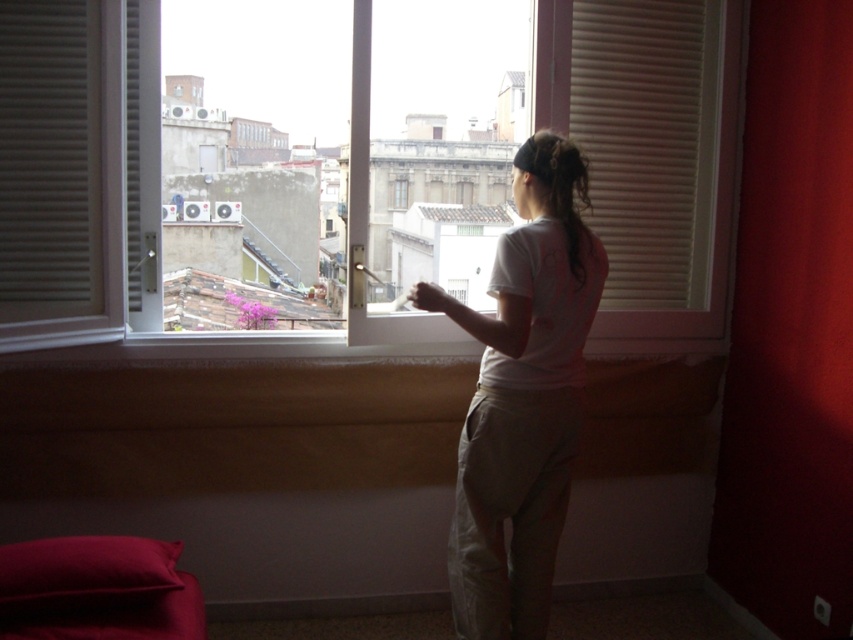
You are standing in the room and want to open the window further. The window is at point (363, 157). Can you reach it from your current position?

The white plastic window at center is located at point (363, 157). Since you are standing in the room, you can reach the window at that point to open it further.

You are a delivery person trying to locate the correct apartment. You see the dark brown hair at upper center and the transparent glass window at center. Based on their positions, which object is closer to the right side of the image?

The dark brown hair at upper center is to the right of the transparent glass window at center, so it is closer to the right side of the image.